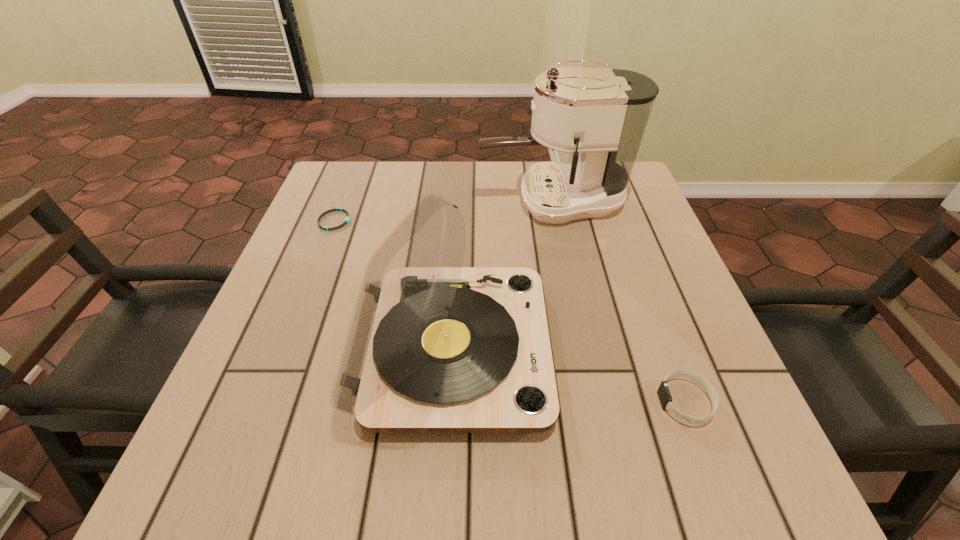
Locate an element on the screen. vacant space located on the outer surface of the right wristband is located at coordinates pyautogui.click(x=598, y=401).

I want to click on vacant region located on the outer surface of the right wristband, so click(x=426, y=401).

Where is `free space located on the outer surface of the right wristband`? The height and width of the screenshot is (540, 960). free space located on the outer surface of the right wristband is located at coordinates (537, 401).

Where is `vacant region located 0.080m on the buckle of the shortest object`? vacant region located 0.080m on the buckle of the shortest object is located at coordinates (384, 221).

Locate an element on the screen. The height and width of the screenshot is (540, 960). coffee maker that is at the far edge is located at coordinates point(600,115).

Locate an element on the screen. wristband at the far edge is located at coordinates (347, 219).

At what (x,y) coordinates should I click in order to perform the action: click on object at the left edge. Please return your answer as a coordinate pair (x, y). Looking at the image, I should click on (347, 219).

Locate an element on the screen. coffee maker present at the right edge is located at coordinates (600, 115).

This screenshot has height=540, width=960. Identify the location of wristband that is at the right edge. (663, 391).

I want to click on object located at the far left corner, so click(x=347, y=219).